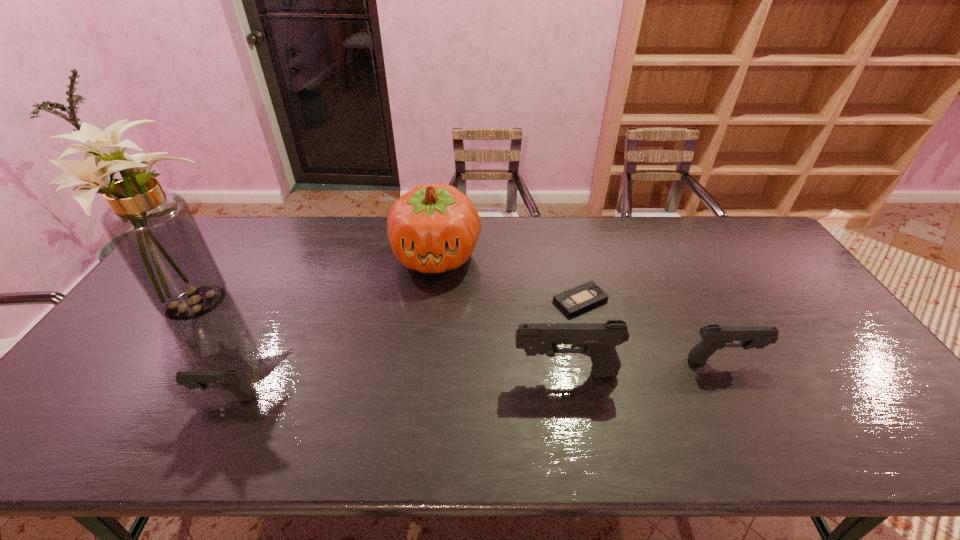
Identify the location of vacant space positioned on the back of the videotape. Image resolution: width=960 pixels, height=540 pixels. [565, 239].

Locate an element on the screen. object positioned at the far edge is located at coordinates (433, 228).

Locate an element on the screen. The width and height of the screenshot is (960, 540). object at the near edge is located at coordinates (231, 380).

Where is `object present at the left edge`? The image size is (960, 540). object present at the left edge is located at coordinates (154, 231).

Locate an element on the screen. This screenshot has height=540, width=960. blank area at the far edge is located at coordinates (683, 248).

Where is `free region at the near edge of the desktop`? The height and width of the screenshot is (540, 960). free region at the near edge of the desktop is located at coordinates (467, 408).

The image size is (960, 540). What are the coordinates of `blank space at the left edge of the desktop` in the screenshot? It's located at (132, 325).

This screenshot has width=960, height=540. In the image, there is a desktop. Identify the location of vacant area at the right edge. (822, 315).

The image size is (960, 540). In the image, there is a desktop. What are the coordinates of `vacant space at the near left corner` in the screenshot? It's located at (60, 405).

This screenshot has width=960, height=540. Identify the location of free space between the fifth tallest object and the leftmost object. (209, 353).